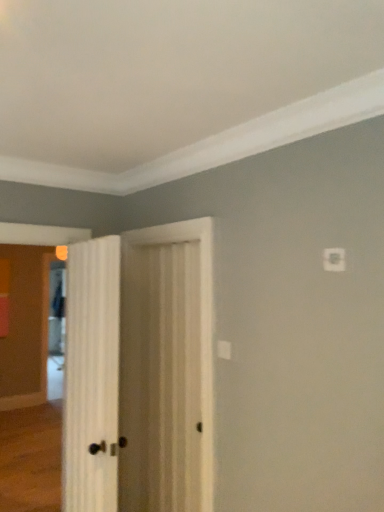
Question: Is white wood door at center, arranged as the first door when viewed from the left, completely or partially inside clear glass screen door at left?

Choices:
 (A) yes
 (B) no

Answer: (B)

Question: Is clear glass screen door at left smaller than white wood door at center, which is the second door in right-to-left order?

Choices:
 (A) no
 (B) yes

Answer: (A)

Question: From a real-world perspective, is clear glass screen door at left positioned over white wood door at center, arranged as the first door when viewed from the left, based on gravity?

Choices:
 (A) no
 (B) yes

Answer: (A)

Question: Is clear glass screen door at left taller than white wood door at center, which is the second door in right-to-left order?

Choices:
 (A) yes
 (B) no

Answer: (A)

Question: Does clear glass screen door at left have a greater width compared to white wood door at center, arranged as the first door when viewed from the left?

Choices:
 (A) no
 (B) yes

Answer: (B)

Question: Would you say clear glass screen door at left is a long distance from white wood door at center, which is the second door in right-to-left order?

Choices:
 (A) yes
 (B) no

Answer: (A)

Question: Considering the relative positions of white wood door at center, which is the 1th door in right-to-left order, and white wood door at center, which is the second door in right-to-left order, in the image provided, is white wood door at center, which is the 1th door in right-to-left order, to the right of white wood door at center, which is the second door in right-to-left order, from the viewer's perspective?

Choices:
 (A) yes
 (B) no

Answer: (A)

Question: Considering the relative sizes of white wood door at center, which is the 1th door in right-to-left order, and white wood door at center, which is the second door in right-to-left order, in the image provided, is white wood door at center, which is the 1th door in right-to-left order, thinner than white wood door at center, which is the second door in right-to-left order,?

Choices:
 (A) yes
 (B) no

Answer: (A)

Question: Can we say white wood door at center, which is the 1th door in right-to-left order, lies outside white wood door at center, arranged as the first door when viewed from the left?

Choices:
 (A) yes
 (B) no

Answer: (A)

Question: From a real-world perspective, is white wood door at center, which is the 1th door in right-to-left order, beneath white wood door at center, which is the second door in right-to-left order?

Choices:
 (A) no
 (B) yes

Answer: (A)

Question: Can you confirm if white wood door at center, which appears as the second door when viewed from the left, is bigger than white wood door at center, arranged as the first door when viewed from the left?

Choices:
 (A) yes
 (B) no

Answer: (B)

Question: Would you say white wood door at center, which appears as the second door when viewed from the left, contains white wood door at center, arranged as the first door when viewed from the left?

Choices:
 (A) no
 (B) yes

Answer: (A)

Question: Is white wood door at center, arranged as the first door when viewed from the left, looking in the opposite direction of clear glass screen door at left?

Choices:
 (A) yes
 (B) no

Answer: (B)